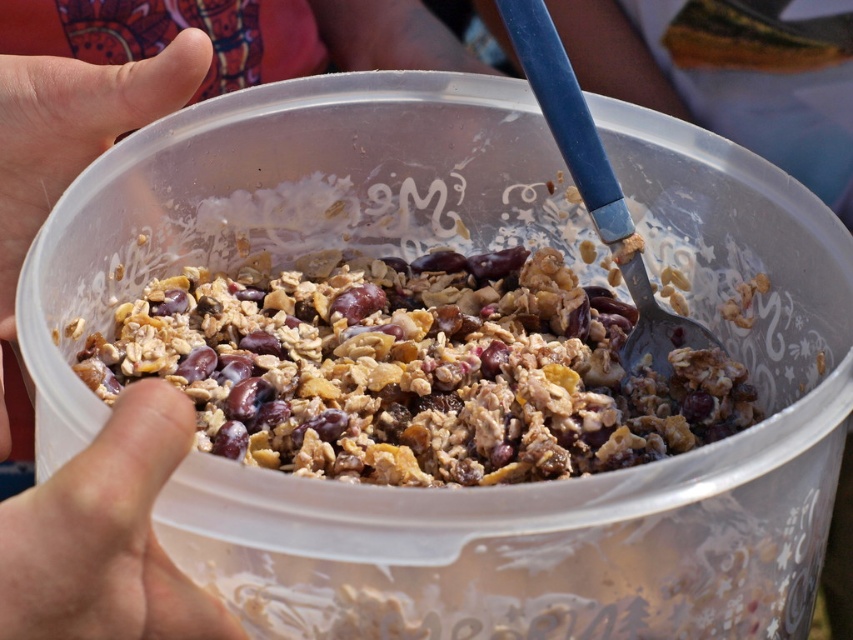
Can you confirm if brown crunchy granola at center is thinner than smooth skin hand at upper left?

No.

Measure the distance between brown crunchy granola at center and smooth skin hand at upper left.

brown crunchy granola at center and smooth skin hand at upper left are 7.08 inches apart from each other.

Is point (196, 321) more distant than point (1, 388)?

Yes, point (196, 321) is behind point (1, 388).

This screenshot has width=853, height=640. I want to click on brown crunchy granola at center, so click(416, 369).

Which is behind, point (144, 488) or point (33, 196)?

The point (33, 196) is more distant.

Does flesh-toned skin at lower left appear on the left side of smooth skin hand at upper left?

Incorrect, flesh-toned skin at lower left is not on the left side of smooth skin hand at upper left.

What do you see at coordinates (106, 536) in the screenshot?
I see `flesh-toned skin at lower left` at bounding box center [106, 536].

Where is `flesh-toned skin at lower left`? The height and width of the screenshot is (640, 853). flesh-toned skin at lower left is located at coordinates (106, 536).

Is brown crunchy granola at center closer to the viewer compared to flesh-toned skin at lower left?

No.

From the picture: Between brown crunchy granola at center and flesh-toned skin at lower left, which one appears on the left side from the viewer's perspective?

From the viewer's perspective, flesh-toned skin at lower left appears more on the left side.

Which is in front, point (405, 451) or point (41, 516)?

Point (41, 516)

At what (x,y) coordinates should I click in order to perform the action: click on brown crunchy granola at center. Please return your answer as a coordinate pair (x, y). Looking at the image, I should click on (416, 369).